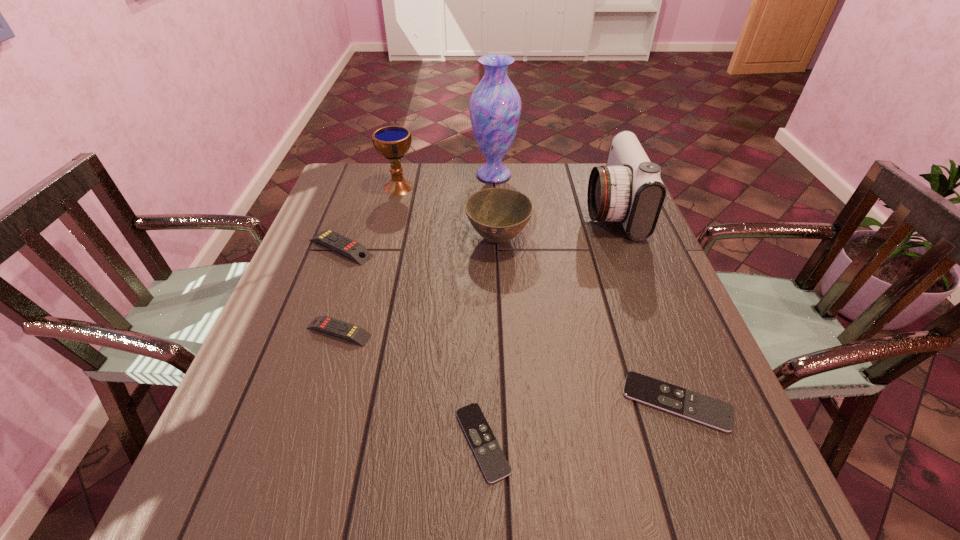
Identify the location of the bigger black remote control. The height and width of the screenshot is (540, 960). (706, 410).

Identify the location of the second remote control from right to left. (488, 452).

At what (x,y) coordinates should I click in order to perform the action: click on the smaller black remote control. Please return your answer as a coordinate pair (x, y). This screenshot has height=540, width=960. Looking at the image, I should click on (488, 452).

Find the location of a particular element. This screenshot has width=960, height=540. blank space located on the front of the vase is located at coordinates tap(495, 206).

Locate an element on the screen. free space located on the surface of the camcorder is located at coordinates (451, 211).

This screenshot has width=960, height=540. In order to click on free space located on the surface of the camcorder in this screenshot , I will do `click(489, 211)`.

What are the coordinates of `vacant region located on the surface of the camcorder` in the screenshot? It's located at [x=547, y=211].

Locate an element on the screen. The height and width of the screenshot is (540, 960). blank space located on the right of the blue chalice is located at coordinates (510, 187).

You are a GUI agent. You are given a task and a screenshot of the screen. Output one action in this format:
    pyautogui.click(x=<x>, y=<y>)
    Task: Click on the free space located on the left of the fifth shortest object
    The width and height of the screenshot is (960, 540).
    Given the screenshot: What is the action you would take?
    pyautogui.click(x=336, y=239)

Image resolution: width=960 pixels, height=540 pixels. I want to click on blank space located on the back of the tallest remote control, so click(x=354, y=211).